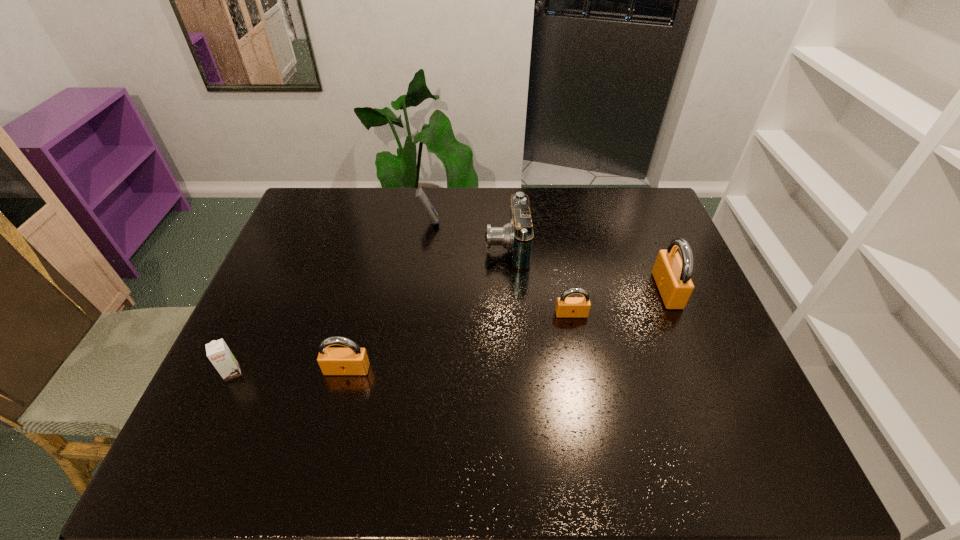
Please point a location where one more padlock can be added evenly. Please provide its 2D coordinates. Your answer should be formatted as a tuple, i.e. [(x, y)], where the tuple contains the x and y coordinates of a point satisfying the conditions above.

[(466, 340)]